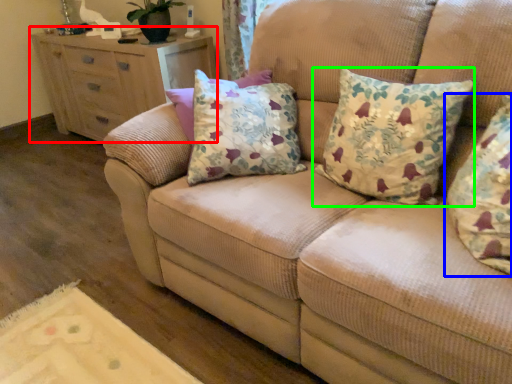
Question: Considering the real-world distances, which object is closest to chest of drawers (highlighted by a red box)? pillow (highlighted by a blue box) or pillow (highlighted by a green box).

Choices:
 (A) pillow
 (B) pillow

Answer: (B)